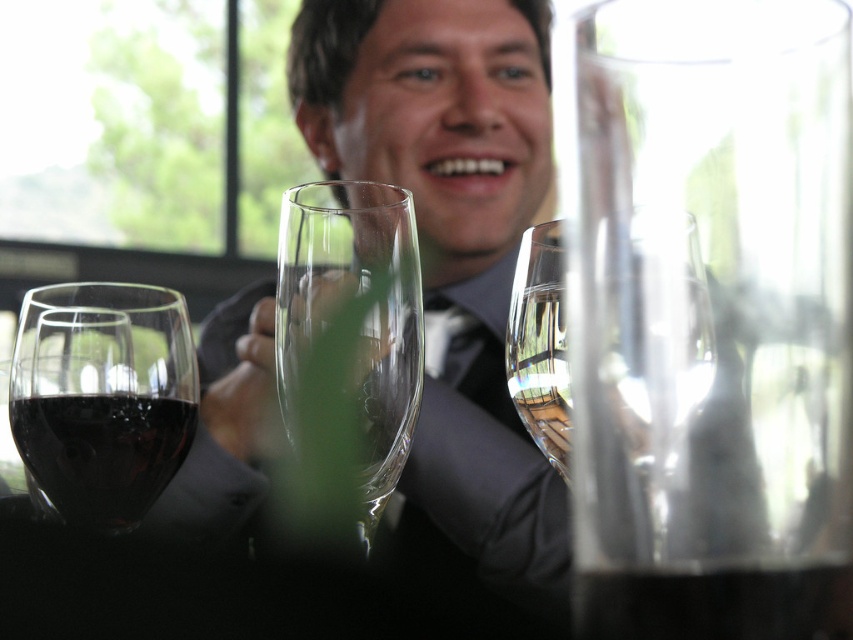
Between transparent glass flute at center and transparent glass wine glass at center, which one has more height?

transparent glass flute at center is taller.

Does transparent glass flute at center have a greater width compared to transparent glass wine glass at center?

Correct, the width of transparent glass flute at center exceeds that of transparent glass wine glass at center.

Locate an element on the screen. This screenshot has height=640, width=853. transparent glass flute at center is located at coordinates (352, 321).

Between shiny dark red wine glass at left and transparent glass at right, which one is positioned higher?

shiny dark red wine glass at left is above.

Who is taller, shiny dark red wine glass at left or transparent glass at right?

With more height is shiny dark red wine glass at left.

Does point (132, 397) come behind point (714, 620)?

Yes, point (132, 397) is behind point (714, 620).

At what (x,y) coordinates should I click in order to perform the action: click on shiny dark red wine glass at left. Please return your answer as a coordinate pair (x, y). Looking at the image, I should click on (102, 397).

Does transparent glass at right have a greater width compared to transparent glass wine glass at center?

Correct, the width of transparent glass at right exceeds that of transparent glass wine glass at center.

Does transparent glass at right have a larger size compared to transparent glass wine glass at center?

No.

Measure the distance between point (637,634) and camera.

A distance of 11.71 centimeters exists between point (637,634) and camera.

Locate an element on the screen. This screenshot has width=853, height=640. transparent glass at right is located at coordinates (715, 604).